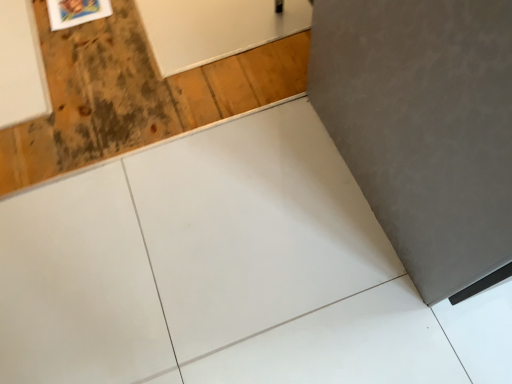
You are a GUI agent. You are given a task and a screenshot of the screen. Output one action in this format:
    pyautogui.click(x=<x>, y=<y>)
    Task: Click on the free spot to the left of wooden frame at upper left
    
    Given the screenshot: What is the action you would take?
    pyautogui.click(x=30, y=15)